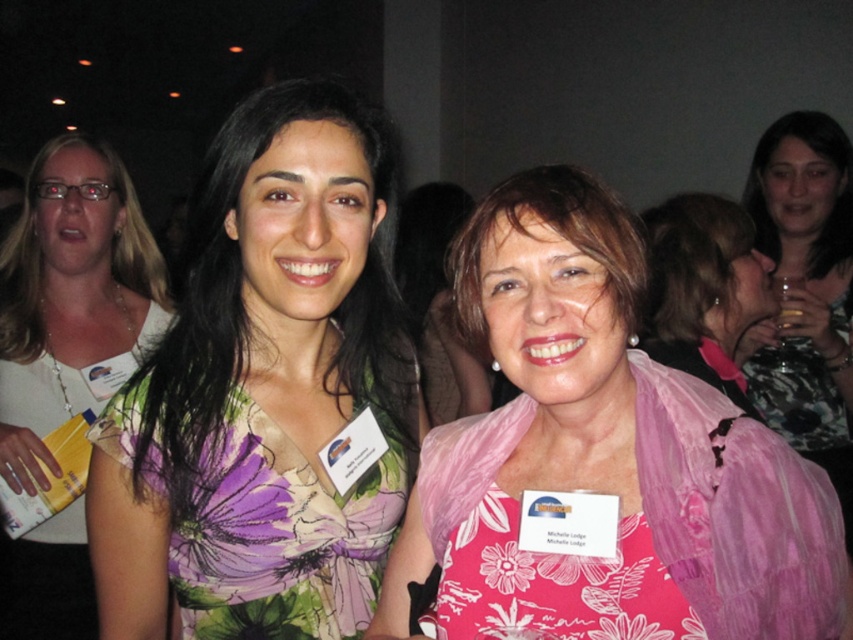
Between point (84, 154) and point (850, 464), which one is positioned in front?

Point (84, 154)

Does white glossy name tag at left appear over black glossy wine glass at right?

Actually, white glossy name tag at left is below black glossy wine glass at right.

Which is in front, point (4, 621) or point (817, 300)?

Point (4, 621)

Where is `white glossy name tag at left`? white glossy name tag at left is located at coordinates click(71, 298).

Can you confirm if floral silk dress at center is positioned above white glossy name tag at left?

No.

Does floral silk dress at center have a greater width compared to white glossy name tag at left?

No.

At what (x,y) coordinates should I click in order to perform the action: click on floral silk dress at center. Please return your answer as a coordinate pair (x, y). Looking at the image, I should click on (253, 522).

The image size is (853, 640). Identify the location of floral silk dress at center. (253, 522).

Can you confirm if pink floral dress at center is shorter than floral silk dress at center?

No.

Is pink floral dress at center taller than floral silk dress at center?

Yes, pink floral dress at center is taller than floral silk dress at center.

At what (x,y) coordinates should I click in order to perform the action: click on pink floral dress at center. Please return your answer as a coordinate pair (x, y). The width and height of the screenshot is (853, 640). Looking at the image, I should click on (604, 442).